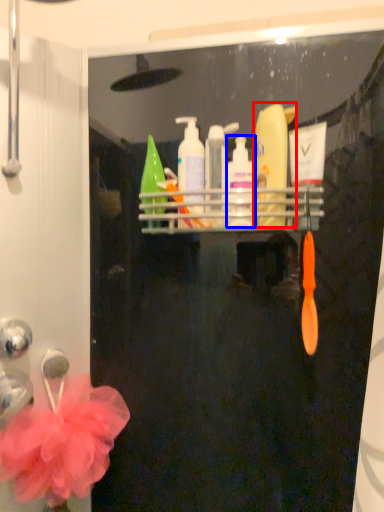
Question: Among these objects, which one is farthest to the camera, cleaning product (highlighted by a red box) or cleaning product (highlighted by a blue box)?

Choices:
 (A) cleaning product
 (B) cleaning product

Answer: (B)